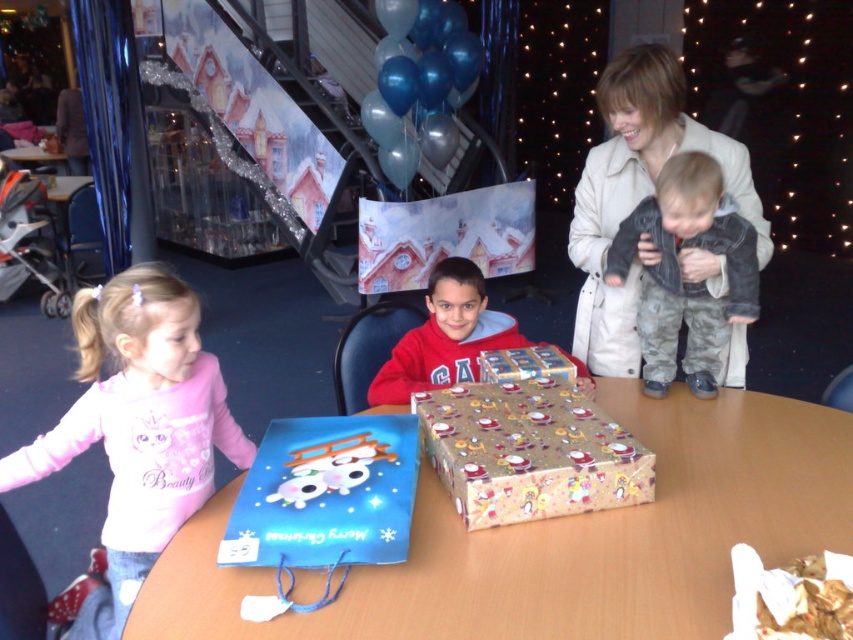
You are organizing a gift wrapping station for an upcoming event. You have a pink fleece shirt at lower left and a gold shiny wrapping paper at center. Which item requires a wider space to accommodate its size?

The pink fleece shirt at lower left requires a wider space because its width is larger than the gold shiny wrapping paper at center.

In the scene shown: You are organizing a party and need to place a new gift on the table. Where should you walk from the pink fleece shirt at lower left to reach the wooden table at center?

The wooden table at center is to the right of the pink fleece shirt at lower left, so you should walk to the right to reach it.

You are organizing a gift wrapping station and need to place both the wooden table at center and the pink fleece shirt at lower left. Given their sizes, which object should you choose as the base for wrapping gifts and why?

The wooden table at center should be chosen as the base for wrapping gifts because it has a larger size compared to the pink fleece shirt at lower left, providing more space for the task.